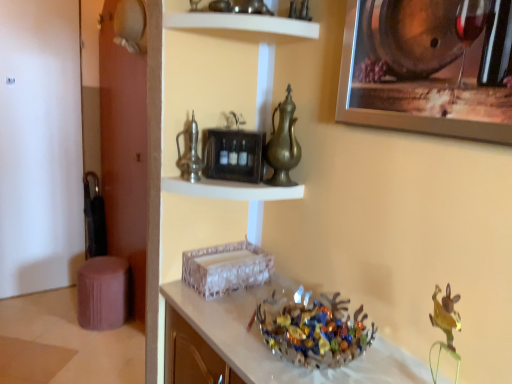
Question: In which direction should I rotate to look at white glossy shelf at upper center, which is counted as the 2th shelf, starting from the bottom?

Choices:
 (A) right
 (B) left

Answer: (B)

Question: Does shiny metallic bowl at center touch metallic silver clock at upper center, which is counted as the 2th shelf, starting from the top?

Choices:
 (A) yes
 (B) no

Answer: (B)

Question: Could metallic silver clock at upper center, which is counted as the 2th shelf, starting from the top, be considered to be inside shiny metallic bowl at center?

Choices:
 (A) no
 (B) yes

Answer: (A)

Question: Can you confirm if shiny metallic bowl at center is bigger than metallic silver clock at upper center, the 1th shelf in the bottom-to-top sequence?

Choices:
 (A) no
 (B) yes

Answer: (B)

Question: From a real-world perspective, is shiny metallic bowl at center located higher than metallic silver clock at upper center, the 1th shelf in the bottom-to-top sequence?

Choices:
 (A) no
 (B) yes

Answer: (A)

Question: From the image's perspective, does shiny metallic bowl at center appear lower than metallic silver clock at upper center, the 1th shelf in the bottom-to-top sequence?

Choices:
 (A) no
 (B) yes

Answer: (B)

Question: Does shiny metallic bowl at center have a lesser width compared to metallic silver clock at upper center, which is counted as the 2th shelf, starting from the top?

Choices:
 (A) no
 (B) yes

Answer: (A)

Question: Is metallic silver picture frame at upper right to the right of white glossy shelf at upper center, arranged as the 1th shelf when viewed from the top, from the viewer's perspective?

Choices:
 (A) yes
 (B) no

Answer: (A)

Question: From a real-world perspective, is metallic silver picture frame at upper right physically below white glossy shelf at upper center, which is counted as the 2th shelf, starting from the bottom?

Choices:
 (A) no
 (B) yes

Answer: (B)

Question: From the image's perspective, is metallic silver picture frame at upper right over white glossy shelf at upper center, arranged as the 1th shelf when viewed from the top?

Choices:
 (A) yes
 (B) no

Answer: (B)

Question: Is there a large distance between metallic silver picture frame at upper right and white glossy shelf at upper center, which is counted as the 2th shelf, starting from the bottom?

Choices:
 (A) no
 (B) yes

Answer: (A)

Question: Considering the relative sizes of metallic silver picture frame at upper right and white glossy shelf at upper center, arranged as the 1th shelf when viewed from the top, in the image provided, is metallic silver picture frame at upper right wider than white glossy shelf at upper center, arranged as the 1th shelf when viewed from the top,?

Choices:
 (A) yes
 (B) no

Answer: (B)

Question: Is metallic silver picture frame at upper right positioned behind white glossy shelf at upper center, which is counted as the 2th shelf, starting from the bottom?

Choices:
 (A) no
 (B) yes

Answer: (A)

Question: From a real-world perspective, does purple fabric stool at lower left sit lower than shiny metallic bowl at center?

Choices:
 (A) yes
 (B) no

Answer: (A)